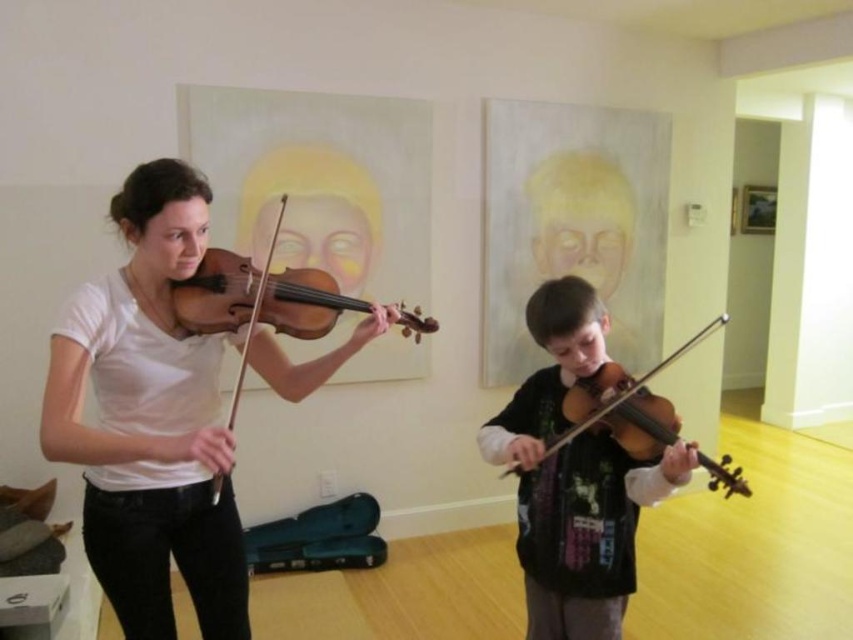
Does matte white violin at left appear over wooden violin at lower center?

Yes.

The width and height of the screenshot is (853, 640). Find the location of `matte white violin at left`. matte white violin at left is located at coordinates (149, 420).

Does matte black violin at center have a greater height compared to wooden violin at center?

Yes.

Between point (560, 529) and point (357, 310), which one is positioned behind?

The point (357, 310) is behind.

Which is in front, point (589, 445) or point (189, 332)?

Point (189, 332) is in front.

Where is `matte black violin at center`? matte black violin at center is located at coordinates (573, 477).

Can you confirm if wooden violin at center is positioned below wooden violin at lower center?

No, wooden violin at center is not below wooden violin at lower center.

Who is more distant from viewer, (x=323, y=289) or (x=566, y=401)?

Positioned behind is point (x=323, y=289).

This screenshot has height=640, width=853. In order to click on wooden violin at center in this screenshot , I will do `click(258, 300)`.

Image resolution: width=853 pixels, height=640 pixels. Identify the location of wooden violin at center. (258, 300).